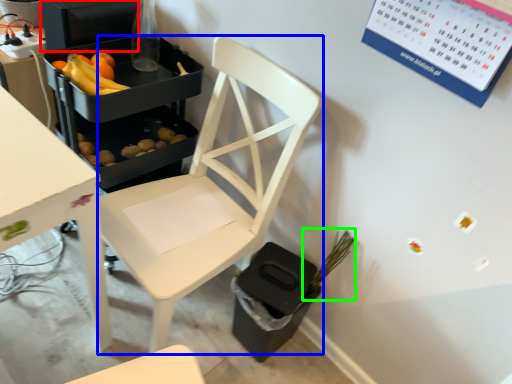
Question: Estimate the real-world distances between objects in this image. Which object is farther from appliance (highlighted by a red box), chair (highlighted by a blue box) or plant (highlighted by a green box)?

Choices:
 (A) chair
 (B) plant

Answer: (B)